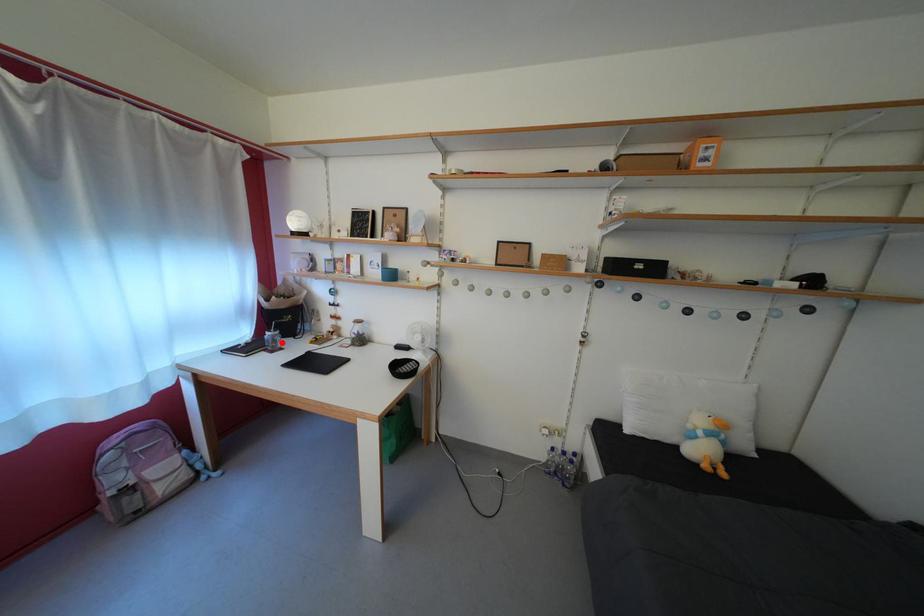
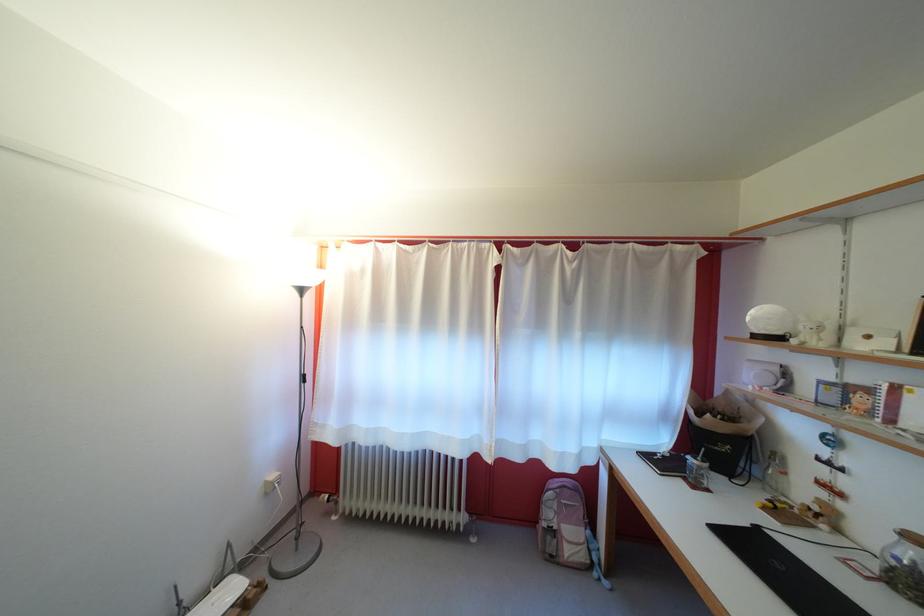
In the second image, find the point that corresponds to the highlighted location in the first image.

(708, 474)